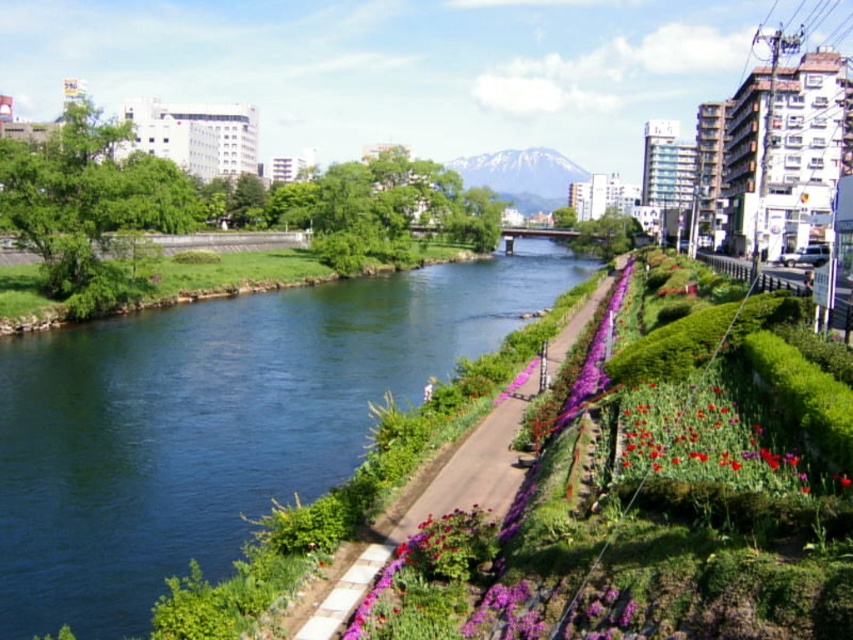
You are standing at the point marked by point (x=213, y=422) in the image. What is the closest object to you in the scene?

The closest object to you is the green smooth water at center, as the point (x=213, y=422) represents the location of the green smooth water at center.

You are a pedestrian walking along the green grassy path at center. You want to cross the river to the other side. Is the green smooth water at center wide enough for you to walk across?

The green smooth water at center is wider than the green grassy path at center. However, the width of the water alone does not indicate if it is safe to cross. The depth and current of the water must also be considered. Since the water appears dark and smooth with a gentle current, it might be deeper than it looks. For safety, it is advisable not to attempt crossing the river on foot unless there is a designated path or bridge.